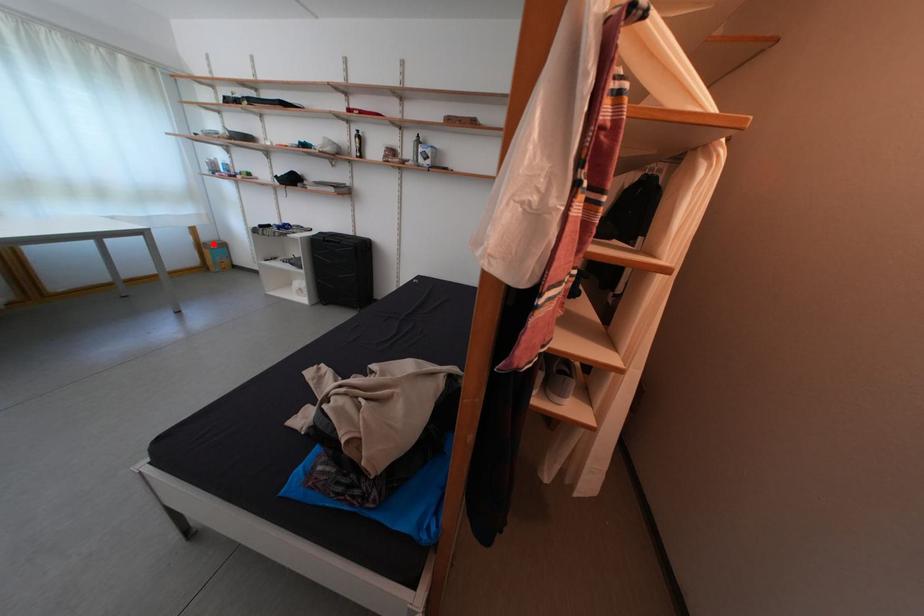
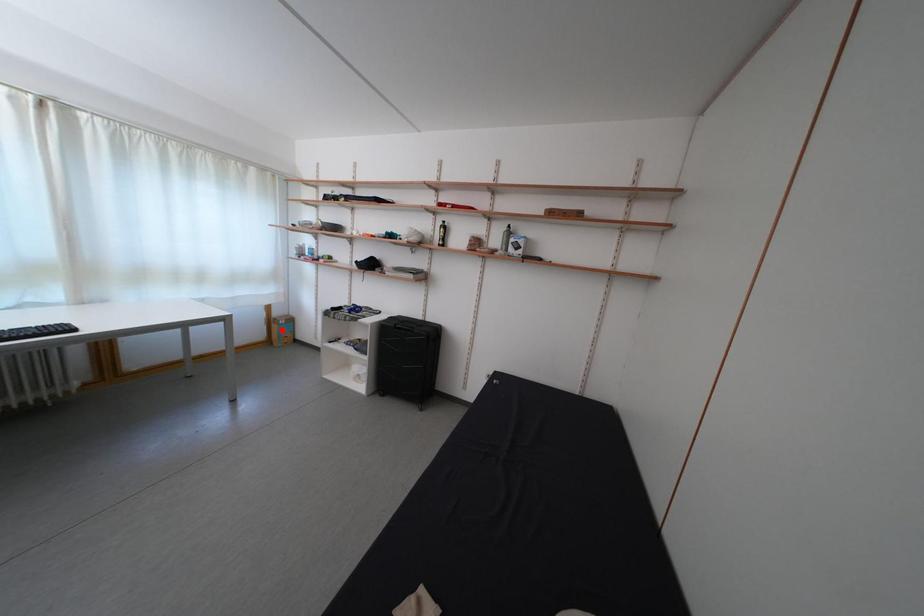
I am providing you with two images of the same scene from different viewpoints. A red point is marked on the first image and another point is marked on the second image. Is the marked point in image1 the same physical position as the marked point in image2?

No